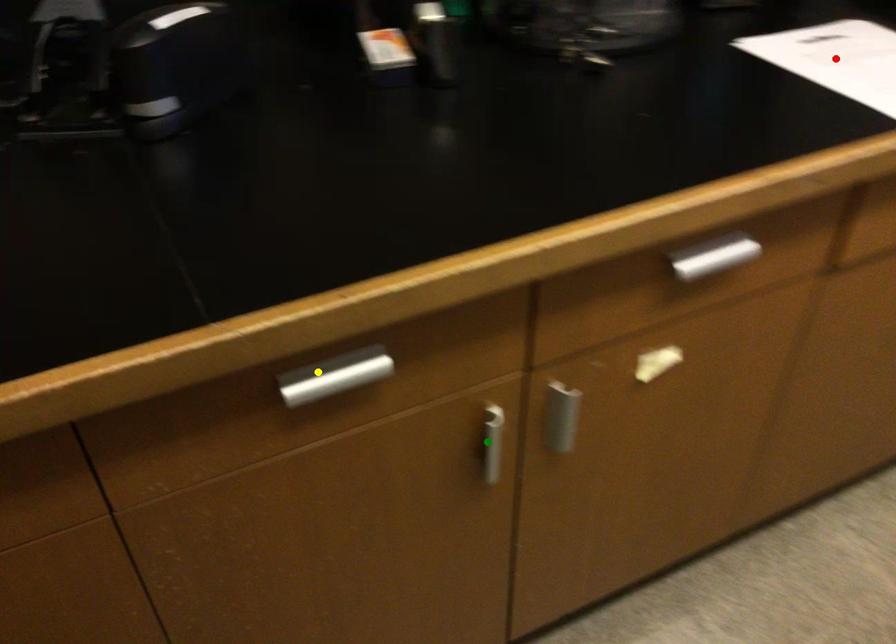
Order these from farthest to nearest:
green point
yellow point
red point

1. red point
2. green point
3. yellow point